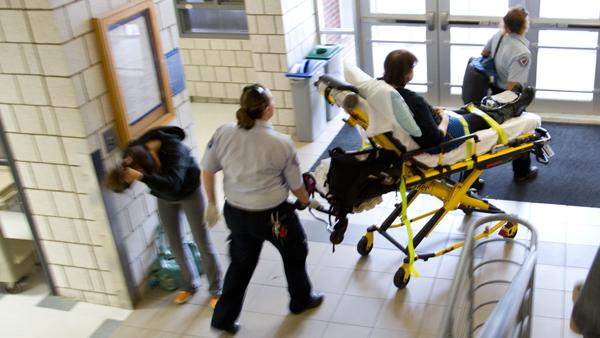
The image size is (600, 338). I want to click on window, so pos(216,21).